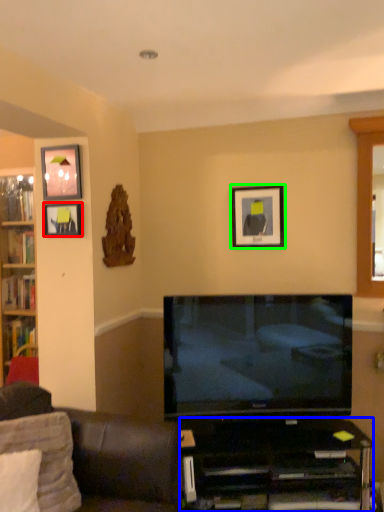
Question: Which is farther away from picture frame (highlighted by a red box)? desk (highlighted by a blue box) or picture frame (highlighted by a green box)?

Choices:
 (A) desk
 (B) picture frame

Answer: (A)